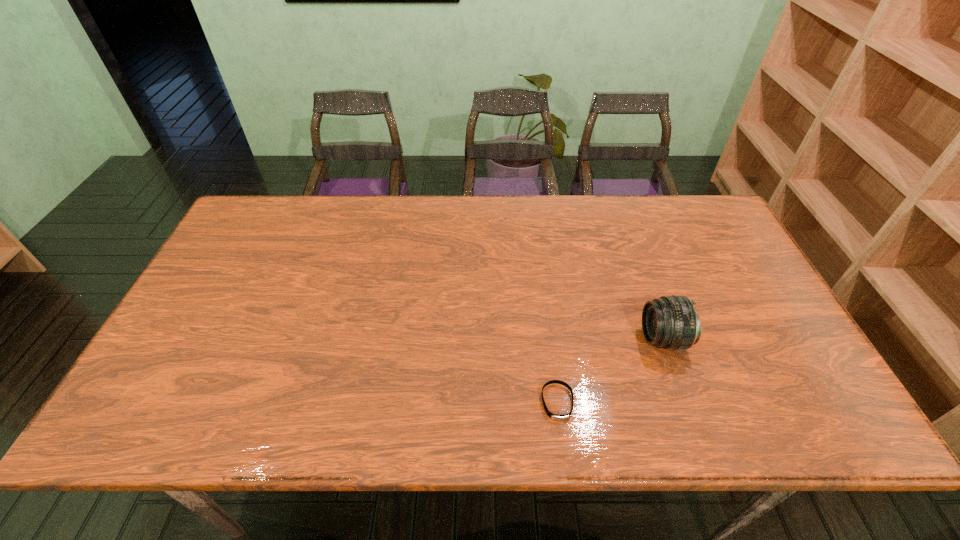
Where is `the farther object`? The image size is (960, 540). the farther object is located at coordinates (672, 322).

I want to click on telephoto lens, so click(x=672, y=322).

The image size is (960, 540). I want to click on the left object, so click(554, 416).

Where is `wristband`? Image resolution: width=960 pixels, height=540 pixels. wristband is located at coordinates (554, 416).

Where is `vacant region located at the front element of the farther object`? vacant region located at the front element of the farther object is located at coordinates (564, 339).

This screenshot has width=960, height=540. In order to click on vacant area situated 0.250m at the front element of the farther object in this screenshot , I will do `click(543, 339)`.

This screenshot has height=540, width=960. I want to click on vacant space positioned 0.220m at the front element of the farther object, so click(555, 339).

The image size is (960, 540). Identify the location of object located at the near edge. (554, 416).

Locate an element on the screen. This screenshot has width=960, height=540. vacant region at the far edge of the desktop is located at coordinates (323, 240).

Where is `vacant space at the near edge`? vacant space at the near edge is located at coordinates (440, 413).